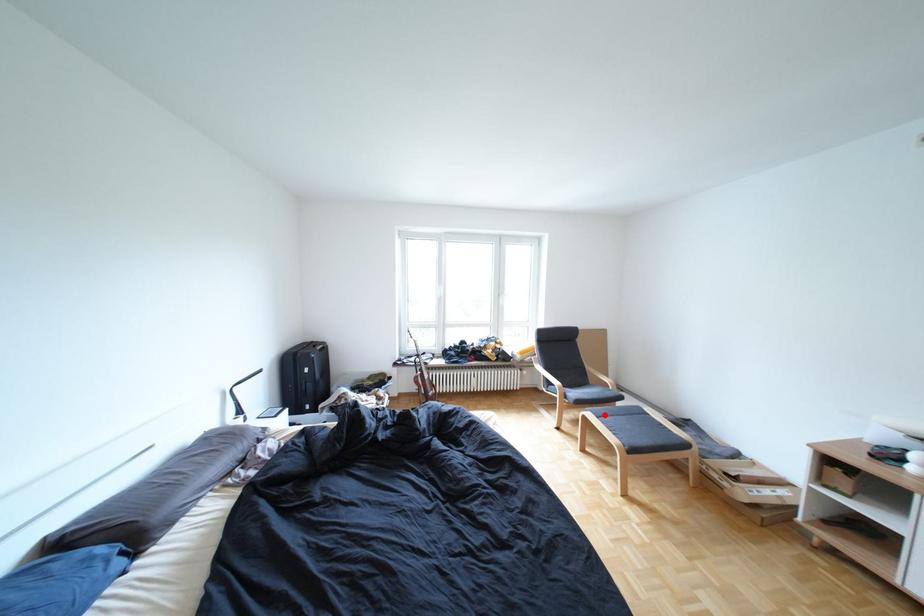
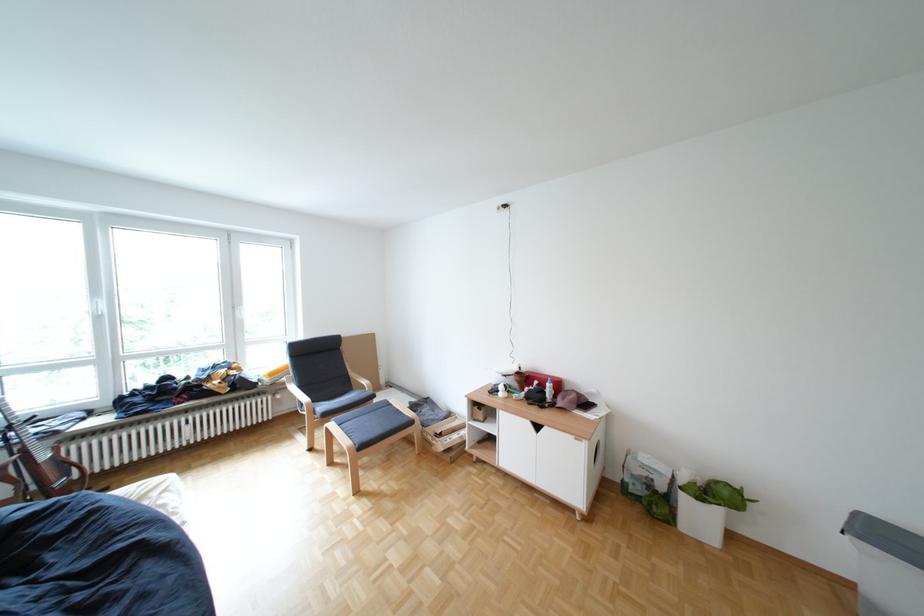
Question: A red point is marked in image1. In image2, is the corresponding 3D point closer to the camera or farther? Reply with the corresponding letter.

Choices:
 (A) The corresponding 3D point is closer.
 (B) The corresponding 3D point is farther.

Answer: (A)